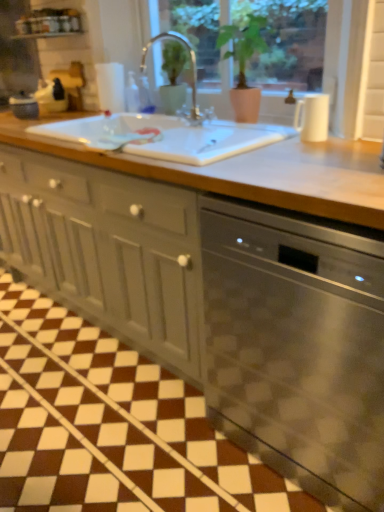
Question: From a real-world perspective, is white glossy window sill at upper center above or below matte gray cabinet at center?

Choices:
 (A) below
 (B) above

Answer: (B)

Question: From the image's perspective, is white glossy window sill at upper center above or below matte gray cabinet at center?

Choices:
 (A) below
 (B) above

Answer: (B)

Question: Estimate the real-world distances between objects in this image. Which object is farther from the white glossy window sill at upper center?

Choices:
 (A) white matte pitcher at upper right, arranged as the 1th appliance when viewed from the front
 (B) satin nickel faucet at center
 (C) matte gray cabinet at center
 (D) stainless steel dishwasher at center
 (E) white ceramic sink at center

Answer: (D)

Question: Considering the real-world distances, which object is farthest from the matte gray cabinet at center?

Choices:
 (A) satin nickel faucet at center
 (B) matte black kettle at left, the 2th appliance from the bottom
 (C) white matte pitcher at upper right, acting as the first appliance starting from the bottom
 (D) stainless steel dishwasher at center
 (E) white glossy window sill at upper center

Answer: (E)